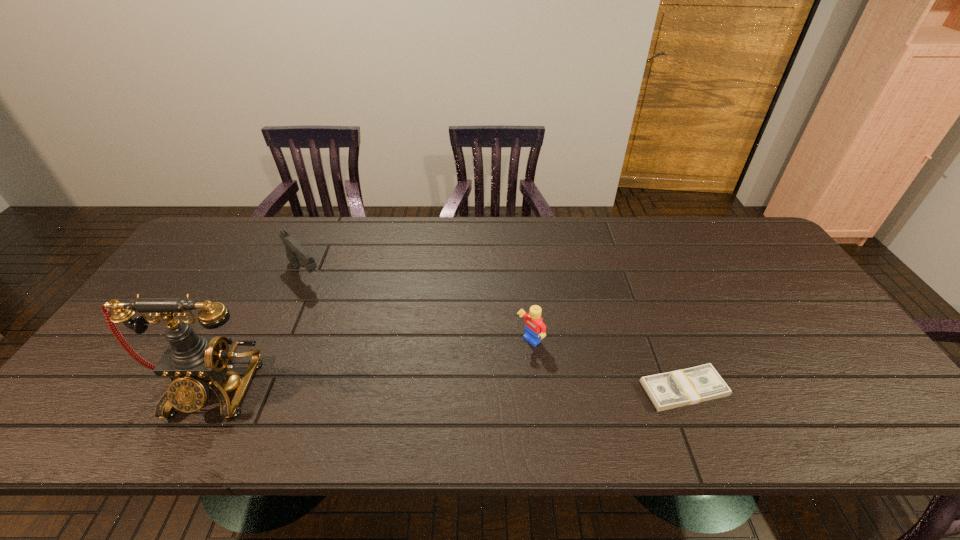
In the image, there is a desktop. At what (x,y) coordinates should I click in order to perform the action: click on vacant space at the far left corner. Please return your answer as a coordinate pair (x, y). Looking at the image, I should click on (204, 242).

Identify the location of free location at the far right corner. The width and height of the screenshot is (960, 540). (709, 231).

Locate an element on the screen. blank region between the farthest object and the dollar is located at coordinates (494, 332).

The width and height of the screenshot is (960, 540). What are the coordinates of `free space that is in between the farthest object and the tallest object` in the screenshot? It's located at (259, 330).

This screenshot has height=540, width=960. Find the location of `free area in between the telephone and the second farthest object`. free area in between the telephone and the second farthest object is located at coordinates (371, 364).

Find the location of a particular element. empty location between the farthest object and the third nearest object is located at coordinates 418,308.

The image size is (960, 540). I want to click on free area in between the third object from left to right and the pistol, so click(418, 308).

Where is `vacant region between the third nearest object and the shortest object`? vacant region between the third nearest object and the shortest object is located at coordinates (607, 365).

You are a GUI agent. You are given a task and a screenshot of the screen. Output one action in this format:
    pyautogui.click(x=<x>, y=<y>)
    Task: Click on the vacant space that is in between the second object from right to left and the tallest object
    Image resolution: width=960 pixels, height=540 pixels.
    Given the screenshot: What is the action you would take?
    pyautogui.click(x=371, y=364)

Locate an element on the screen. The width and height of the screenshot is (960, 540). unoccupied position between the second farthest object and the rightmost object is located at coordinates pyautogui.click(x=607, y=365).